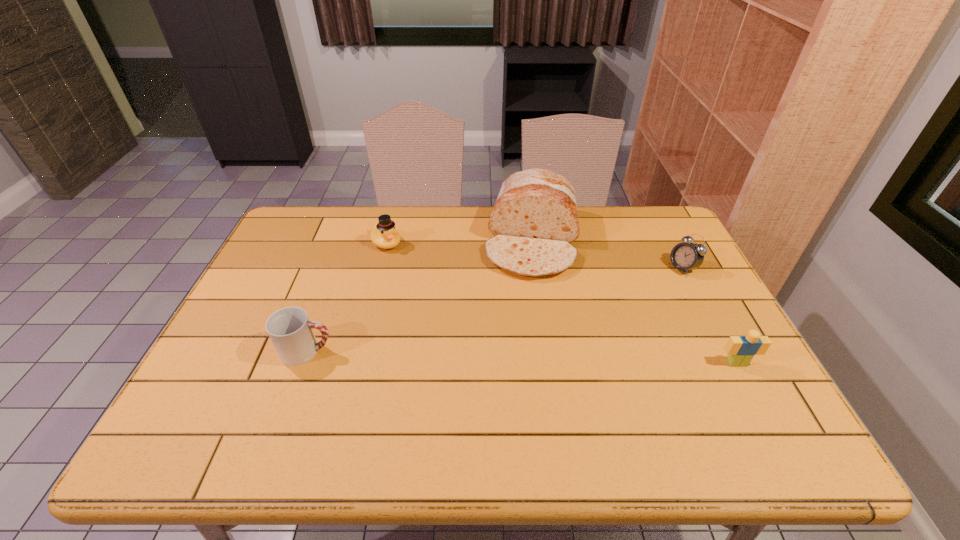
Where is `the leftmost object`? The height and width of the screenshot is (540, 960). the leftmost object is located at coordinates (291, 332).

Where is `Lego`? Lego is located at coordinates (741, 350).

At what (x,y) coordinates should I click in order to perform the action: click on bread. Please return your answer as a coordinate pair (x, y). Looking at the image, I should click on point(534,220).

You are a GUI agent. You are given a task and a screenshot of the screen. Output one action in this format:
    pyautogui.click(x=<x>, y=<y>)
    Task: Click on the tallest object
    The width and height of the screenshot is (960, 540).
    Given the screenshot: What is the action you would take?
    pyautogui.click(x=534, y=220)

Find the location of a particular element. Image resolution: width=960 pixels, height=540 pixels. the second object from left to right is located at coordinates (384, 235).

The height and width of the screenshot is (540, 960). In order to click on alarm clock in this screenshot , I will do `click(686, 256)`.

At what (x,y) coordinates should I click in order to perform the action: click on vacant space located 0.250m on the side of the leftmost object where the handle is located. Please return your answer as a coordinate pair (x, y). The width and height of the screenshot is (960, 540). Looking at the image, I should click on (434, 351).

Locate an element on the screen. The height and width of the screenshot is (540, 960). free space located on the face of the Lego is located at coordinates (756, 400).

Where is `blank space located 0.380m at the sliced end of the tallest object`? blank space located 0.380m at the sliced end of the tallest object is located at coordinates (516, 392).

Where is `vacant space positioned at the sliced end of the tallest object`? vacant space positioned at the sliced end of the tallest object is located at coordinates (518, 381).